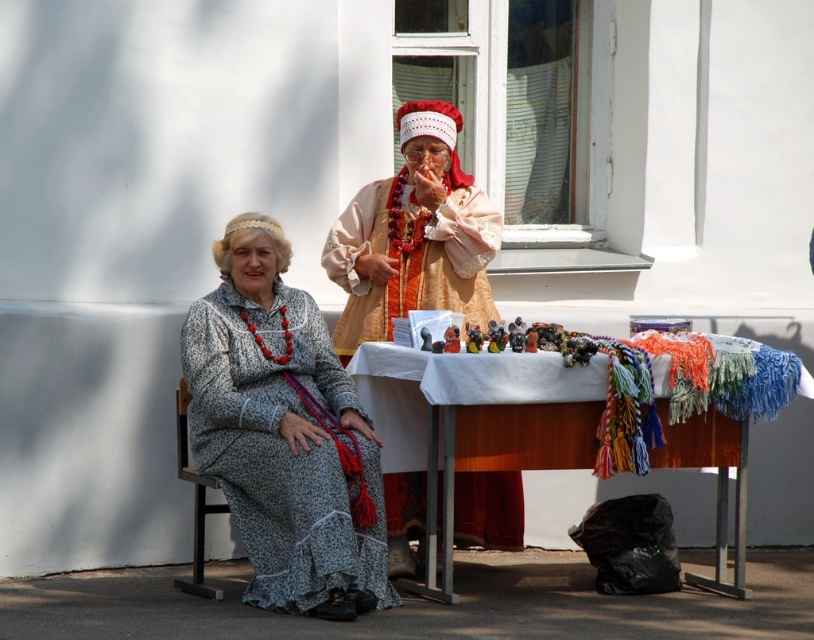
You are a photographer trying to capture a closeup of the printed fabric dress at center and the matte orange fabric robe at center. Which one will appear larger in your photo?

The printed fabric dress at center will appear larger in the photo because it is closer to the viewer than the matte orange fabric robe at center.